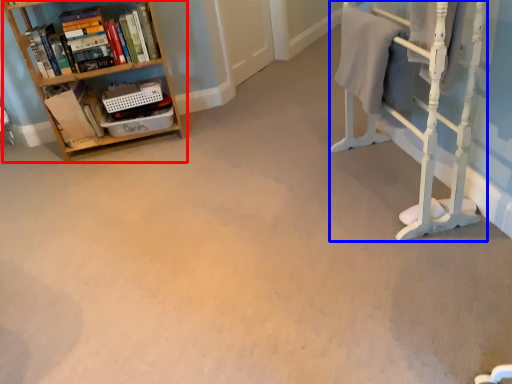
Question: Which of the following is the closest to the observer, shelf (highlighted by a red box) or bunk bed (highlighted by a blue box)?

Choices:
 (A) shelf
 (B) bunk bed

Answer: (B)